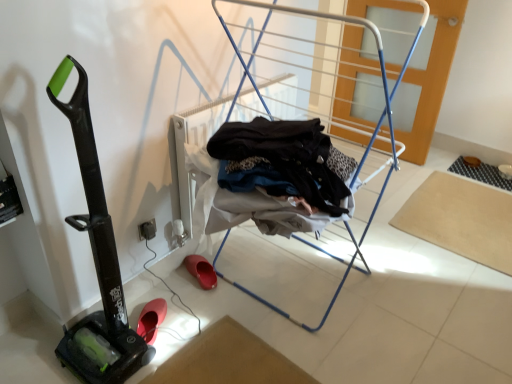
The image size is (512, 384). In order to click on vacant space that's between black rubber vacuum at left and beige fabric yoga mat at lower right in this screenshot , I will do `click(326, 274)`.